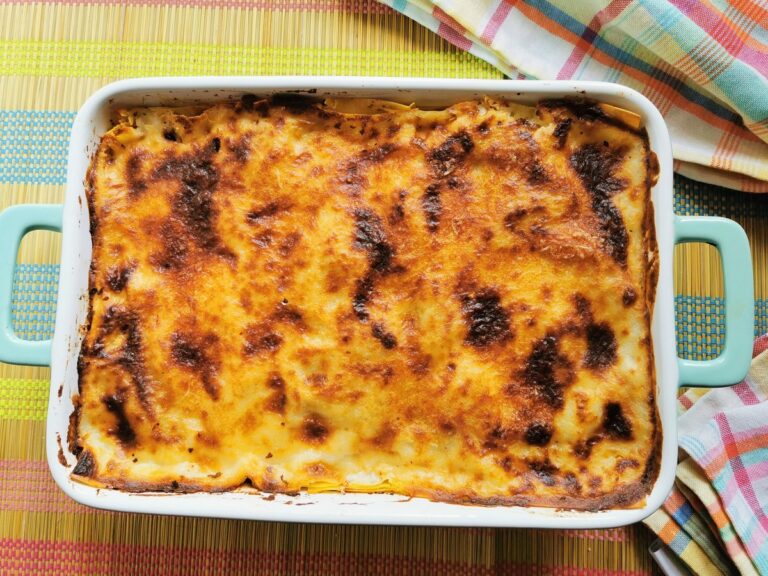
You are a GUI agent. You are given a task and a screenshot of the screen. Output one action in this format:
    pyautogui.click(x=<x>, y=<y>)
    Task: Click on the handles
    This screenshot has height=576, width=768.
    Given the screenshot: What is the action you would take?
    pyautogui.click(x=736, y=289), pyautogui.click(x=8, y=267)